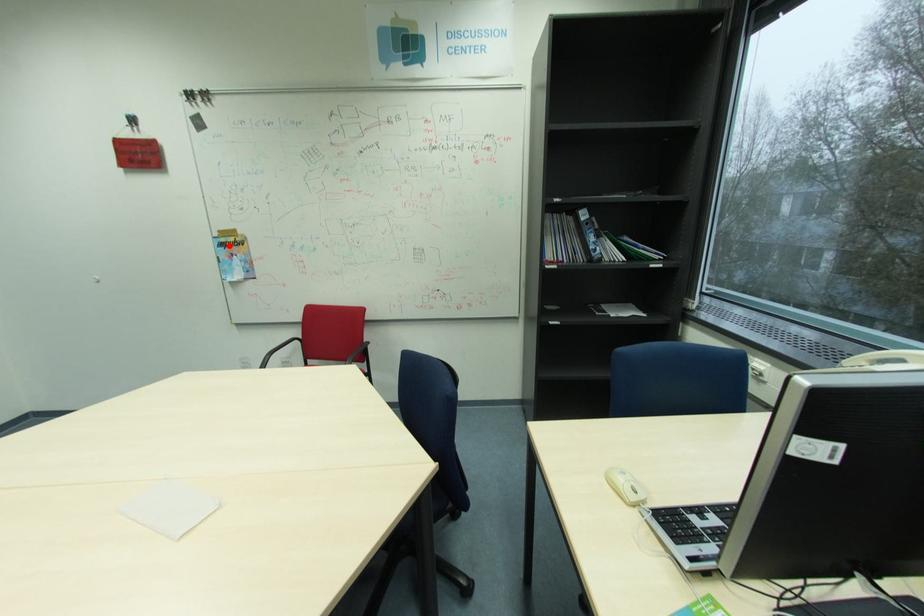
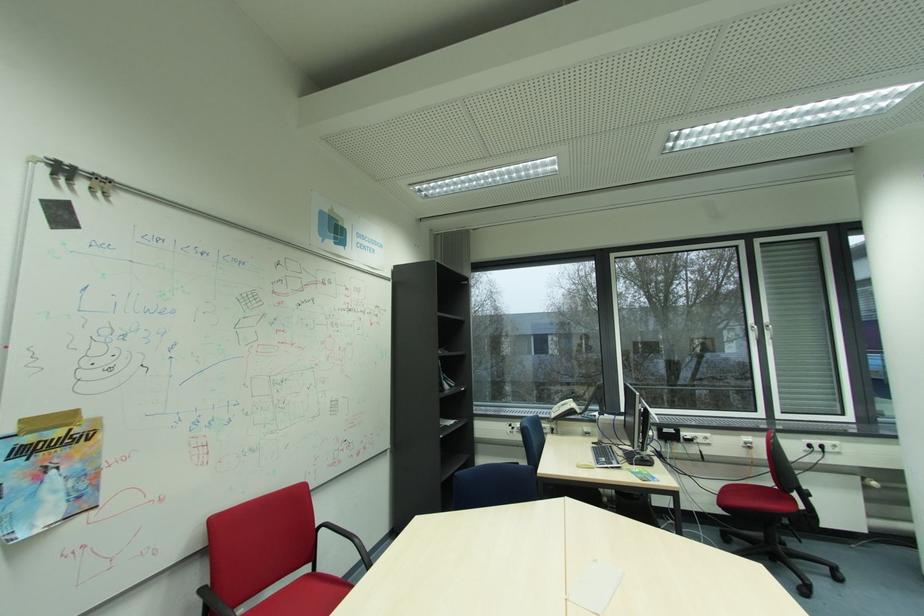
Question: I am providing you with two images of the same scene from different viewpoints. A red point is marked on the first image. At the location where the point appears in image 1, is it still visible in image 2?

Choices:
 (A) Yes
 (B) No

Answer: (A)